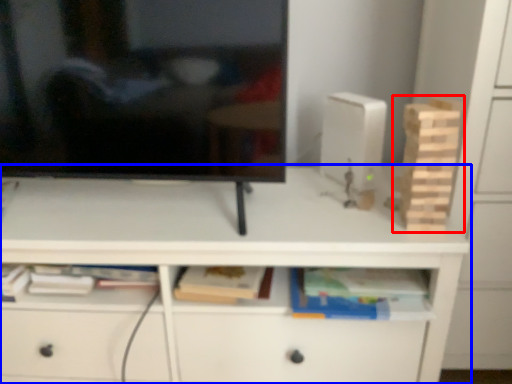
Question: Which object appears farthest to the camera in this image, toy (highlighted by a red box) or desk (highlighted by a blue box)?

Choices:
 (A) toy
 (B) desk

Answer: (B)